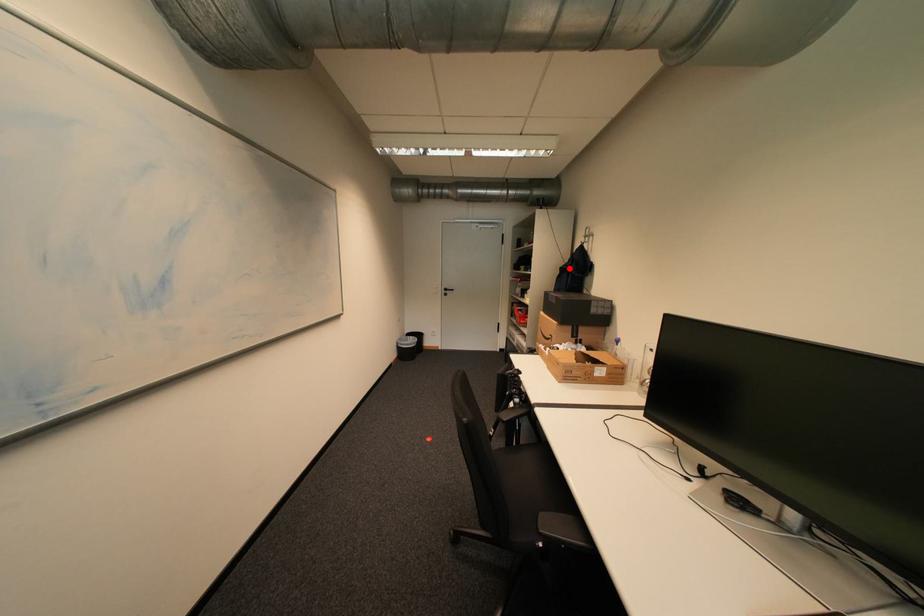
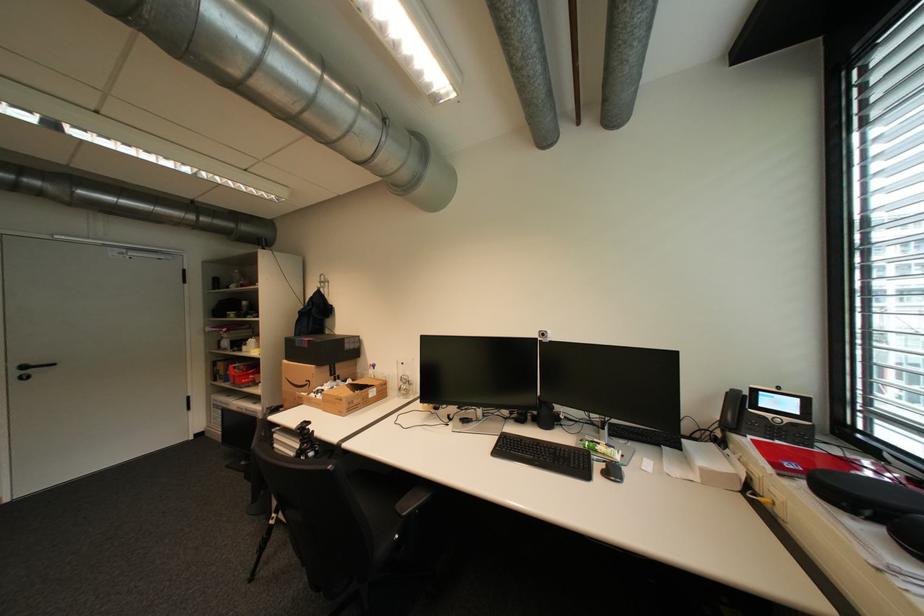
In the second image, find the point that corresponds to the highlighted location in the first image.

(308, 312)